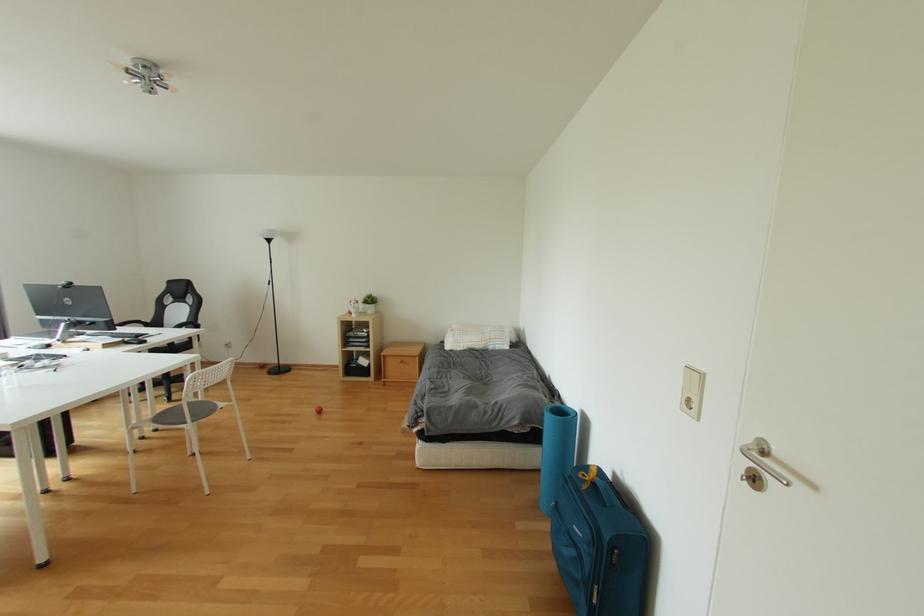
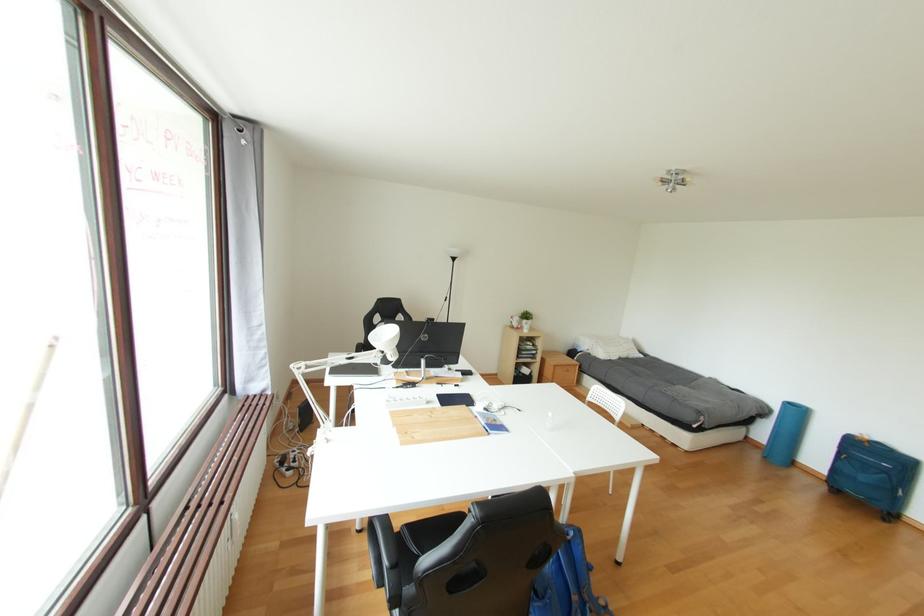
Question: Which direction would the cameraman need to move to produce the second image? Reply with the corresponding letter.

Choices:
 (A) Left
 (B) Right
 (C) Forward
 (D) Backward

Answer: (A)